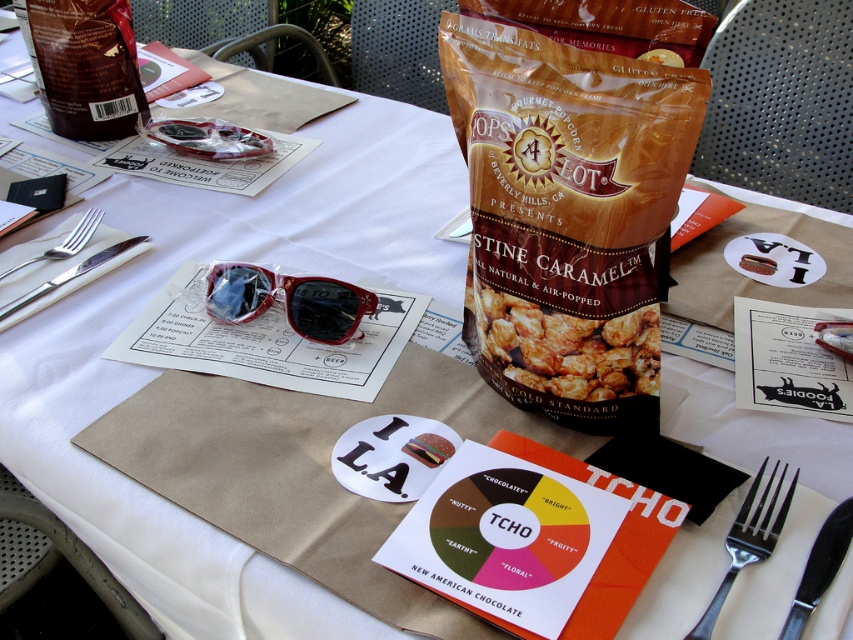
You are standing at the edge of the table and want to reach both points on the table. Which point, point (x=834, y=529) or point (x=41, y=292), is closer to you?

Point (x=834, y=529) is closer to the viewer than point (x=41, y=292).

You are a server at an outdoor event and need to reach for the black metal knife at lower right and the silvermetallicfork and knife at left. Which one can you grab first without moving your position?

The black metal knife at lower right is closer to the viewer than the silvermetallicfork and knife at left, so you can grab it first without moving.

You are a server at an outdoor event and need to determine which utensil is taller between the silver metallic fork at lower right and the black metal knife at lower right. Based on the table setup, which one should you choose?

The silver metallic fork at lower right is taller than the black metal knife at lower right, so you should choose the silver metallic fork at lower right.